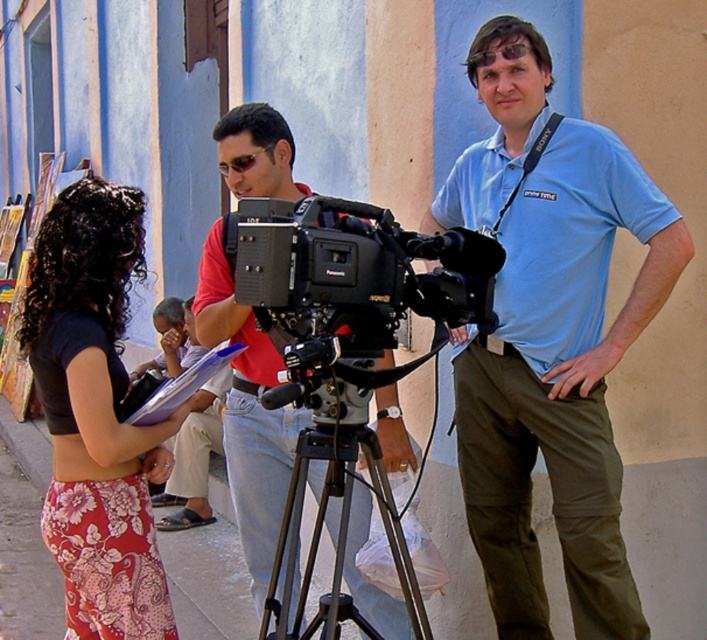
Locate an element on the screen. The image size is (707, 640). floral cotton skirt at lower left is located at coordinates (95, 413).

Does floral cotton skirt at lower left have a greater width compared to black metal tripod at center?

In fact, floral cotton skirt at lower left might be narrower than black metal tripod at center.

Describe the element at coordinates (95, 413) in the screenshot. This screenshot has width=707, height=640. I see `floral cotton skirt at lower left` at that location.

The height and width of the screenshot is (640, 707). I want to click on floral cotton skirt at lower left, so click(95, 413).

Who is more forward, (x=617, y=556) or (x=267, y=624)?

Point (x=267, y=624)

Is blue cotton shirt at center above black metal tripod at center?

Yes.

At what (x,y) coordinates should I click in order to perform the action: click on blue cotton shirt at center. Please return your answer as a coordinate pair (x, y). The width and height of the screenshot is (707, 640). Looking at the image, I should click on (549, 339).

This screenshot has height=640, width=707. Find the location of `blue cotton shirt at center`. blue cotton shirt at center is located at coordinates (549, 339).

Is red matte camera at center taller than black plastic camera at center?

Correct, red matte camera at center is much taller as black plastic camera at center.

Is point (350, 563) closer to camera compared to point (366, 243)?

No, (350, 563) is further to viewer.

Identify the location of red matte camera at center. [247, 416].